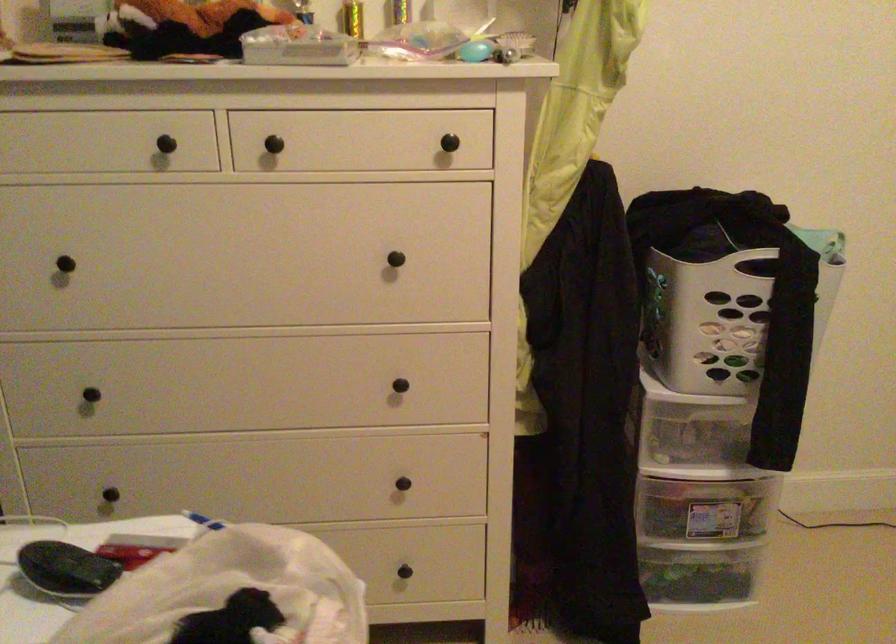
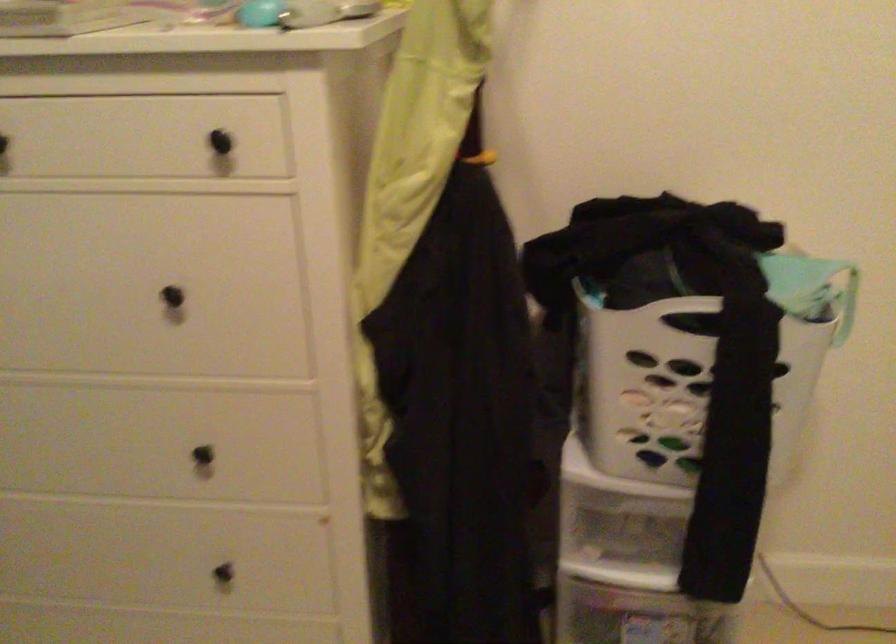
In the second image, find the point that corresponds to point 391,266 in the first image.

(178, 305)